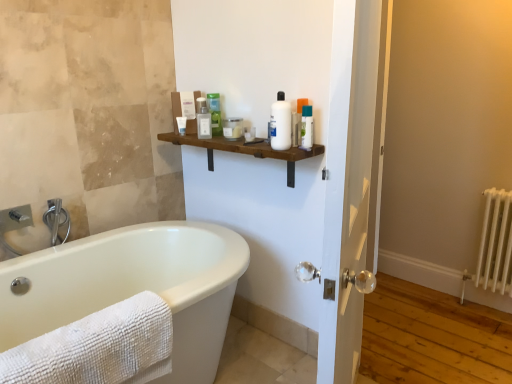
Question: Is translucent plastic bottle at upper center, which is the 5th toiletry in right-to-left order, looking in the opposite direction of white textured towel at lower left?

Choices:
 (A) no
 (B) yes

Answer: (A)

Question: Can you confirm if translucent plastic bottle at upper center, which is the 5th toiletry in right-to-left order, is wider than white textured towel at lower left?

Choices:
 (A) no
 (B) yes

Answer: (A)

Question: Can we say translucent plastic bottle at upper center, acting as the 2th toiletry starting from the left, lies outside white textured towel at lower left?

Choices:
 (A) no
 (B) yes

Answer: (B)

Question: Can you confirm if translucent plastic bottle at upper center, which is the 5th toiletry in right-to-left order, is positioned to the left of white textured towel at lower left?

Choices:
 (A) no
 (B) yes

Answer: (A)

Question: Is the depth of translucent plastic bottle at upper center, acting as the 2th toiletry starting from the left, greater than that of white textured towel at lower left?

Choices:
 (A) yes
 (B) no

Answer: (A)

Question: From the image's perspective, is translucent plastic bottle at upper center, acting as the 2th toiletry starting from the left, over white textured towel at lower left?

Choices:
 (A) no
 (B) yes

Answer: (B)

Question: Is wooden shelf at center completely or partially outside of white metallic radiator at right?

Choices:
 (A) yes
 (B) no

Answer: (A)

Question: From a real-world perspective, is wooden shelf at center located beneath white metallic radiator at right?

Choices:
 (A) no
 (B) yes

Answer: (A)

Question: Is wooden shelf at center touching white metallic radiator at right?

Choices:
 (A) no
 (B) yes

Answer: (A)

Question: From a real-world perspective, is wooden shelf at center on white metallic radiator at right?

Choices:
 (A) yes
 (B) no

Answer: (A)

Question: Are wooden shelf at center and white metallic radiator at right far apart?

Choices:
 (A) no
 (B) yes

Answer: (B)

Question: From the image's perspective, is wooden shelf at center on white metallic radiator at right?

Choices:
 (A) no
 (B) yes

Answer: (B)

Question: Does brushed metal faucet at left lie behind green matte bottle at upper center, the fourth toiletry in the right-to-left sequence?

Choices:
 (A) no
 (B) yes

Answer: (A)